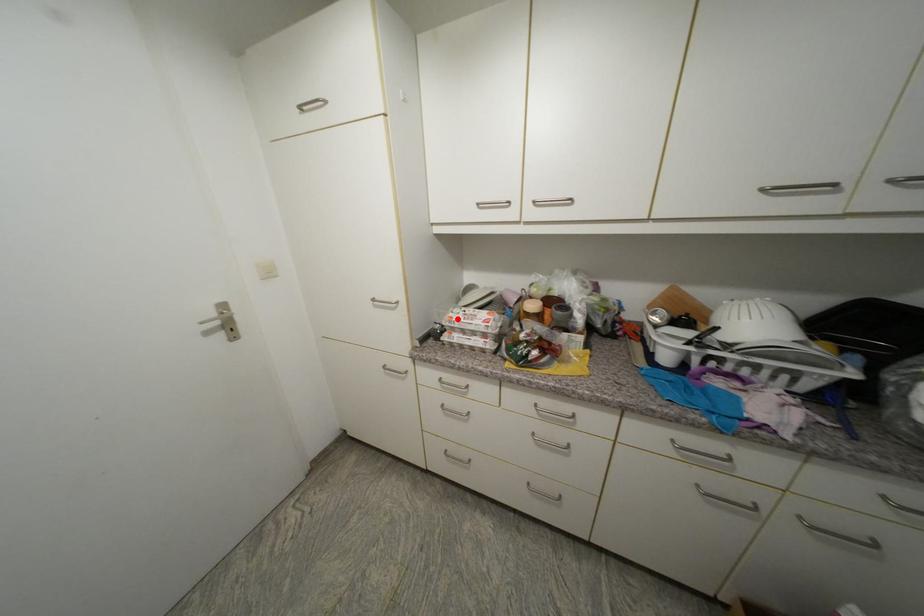
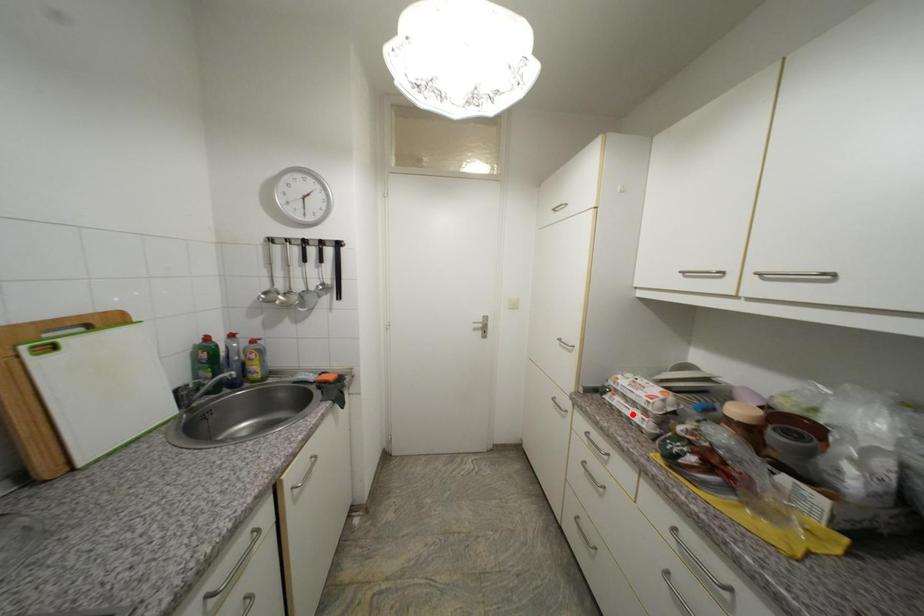
I am providing you with two images of the same scene from different viewpoints. A red point is marked on the first image and another point is marked on the second image. Do the highlighted points in image1 and image2 indicate the same real-world spot?

No